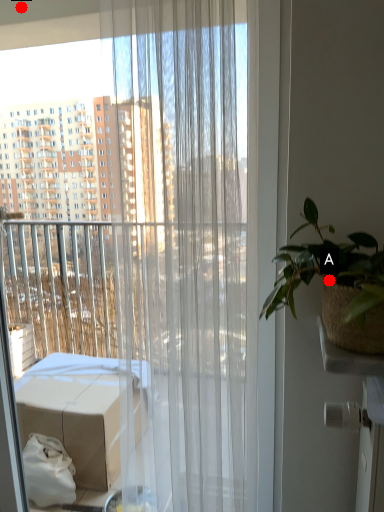
Question: Two points are circled on the image, labeled by A and B beside each circle. Which of the following is the farthest from the observer?

Choices:
 (A) A is further
 (B) B is further

Answer: (B)